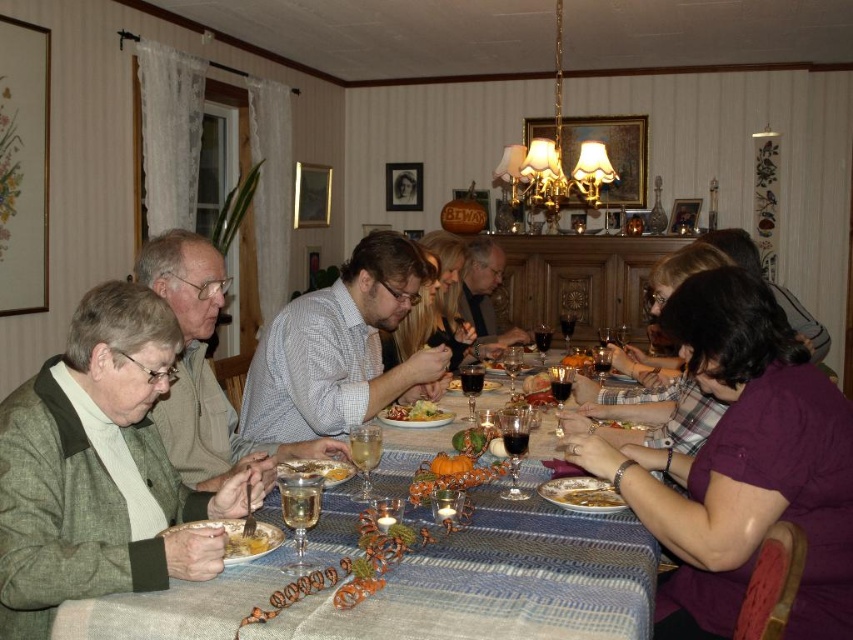
Question: Is green knitted sweater at lower left closer to the viewer compared to white porcelain bowl at center?

Choices:
 (A) yes
 (B) no

Answer: (A)

Question: Which point appears farthest from the camera in this image?

Choices:
 (A) (312, 465)
 (B) (581, 352)
 (C) (415, 416)
 (D) (518, 340)

Answer: (B)

Question: In this image, where is purple matte shirt at lower right located relative to yellow matte plate at lower left?

Choices:
 (A) above
 (B) below

Answer: (A)

Question: Estimate the real-world distances between objects in this image. Which object is closer to the smooth pumpkin at center?

Choices:
 (A) white porcelain bowl at center
 (B) purple matte shirt at lower right
 (C) checkered fabric shirt at center
 (D) green knitted sweater at lower left

Answer: (C)

Question: Is green knitted sweater at lower left to the left of checkered fabric shirt at center from the viewer's perspective?

Choices:
 (A) yes
 (B) no

Answer: (A)

Question: Considering the real-world distances, which object is farthest from the yellowish matte pasta at center?

Choices:
 (A) yellow matte plate at lower left
 (B) smooth pumpkin at center
 (C) white porcelain bowl at center

Answer: (B)